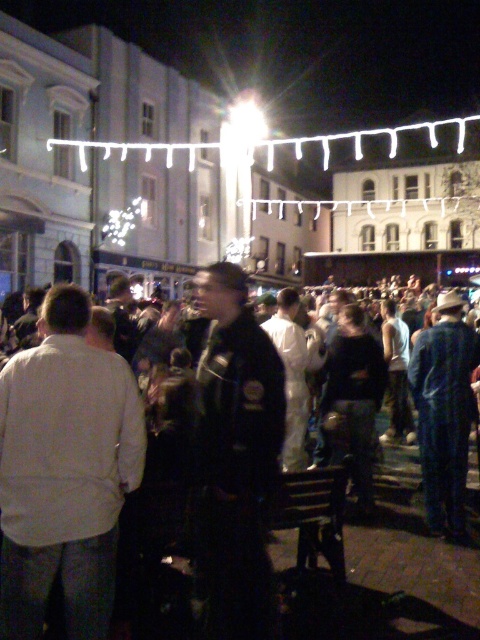
Question: Does white matte shirt at center have a greater width compared to blue denim jeans at lower right?

Choices:
 (A) yes
 (B) no

Answer: (A)

Question: Which point is farther to the camera?

Choices:
 (A) white matte shirt at center
 (B) blue denim jeans at lower right

Answer: (B)

Question: Is white matte shirt at center closer to camera compared to blue denim jeans at lower right?

Choices:
 (A) no
 (B) yes

Answer: (B)

Question: Does white matte shirt at center have a greater width compared to blue denim jeans at lower right?

Choices:
 (A) no
 (B) yes

Answer: (B)